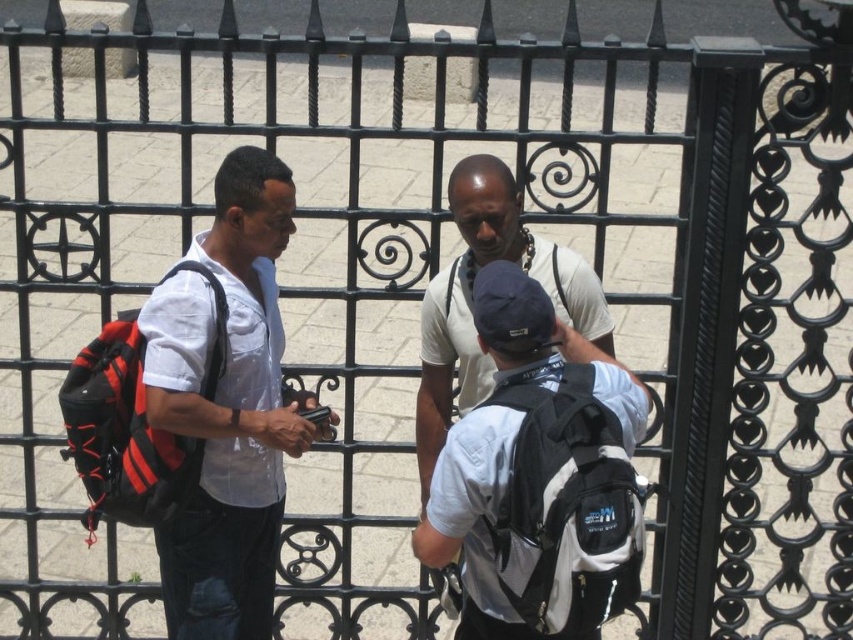
Question: Which of these objects is positioned closest to the matte white shirt at center?

Choices:
 (A) white matte backpack at center
 (B) white matte shirt at center
 (C) red and black fabric backpack at left

Answer: (C)

Question: Which of the following is the closest to the observer?

Choices:
 (A) (515, 513)
 (B) (117, 481)

Answer: (A)

Question: Which is farther from the matte white shirt at center?

Choices:
 (A) white matte backpack at center
 (B) red and black fabric backpack at left

Answer: (A)

Question: Can you confirm if white matte backpack at center is bigger than red and black fabric backpack at left?

Choices:
 (A) no
 (B) yes

Answer: (B)

Question: Can you confirm if white matte shirt at center is positioned above red and black fabric backpack at left?

Choices:
 (A) no
 (B) yes

Answer: (B)

Question: Is white matte shirt at center to the right of red and black fabric backpack at left from the viewer's perspective?

Choices:
 (A) no
 (B) yes

Answer: (B)